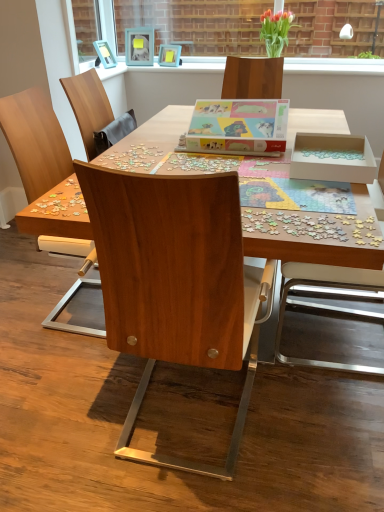
Find the location of a particular element. The image size is (384, 512). free spot below wooden chair at center, the first chair from the right (from a real-world perspective) is located at coordinates (362, 342).